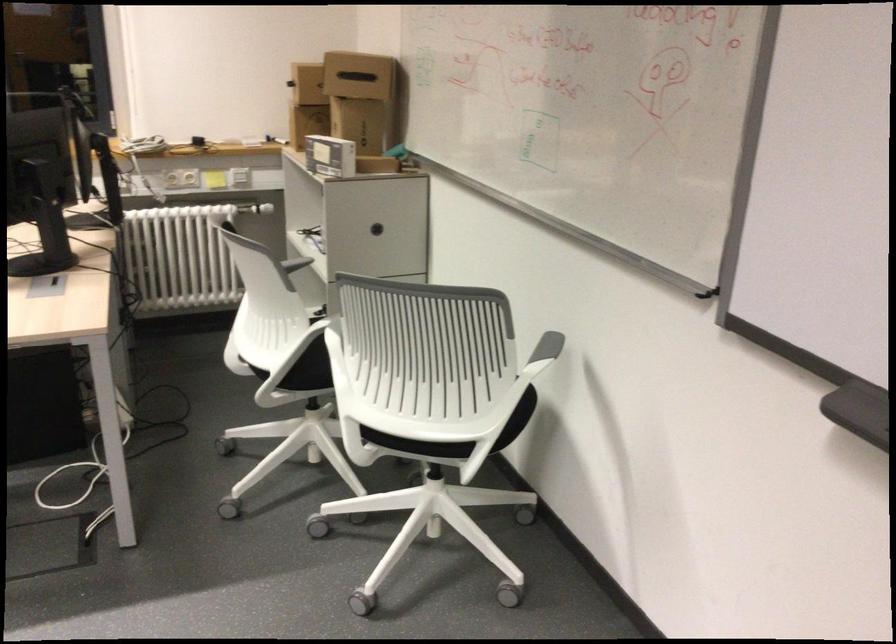
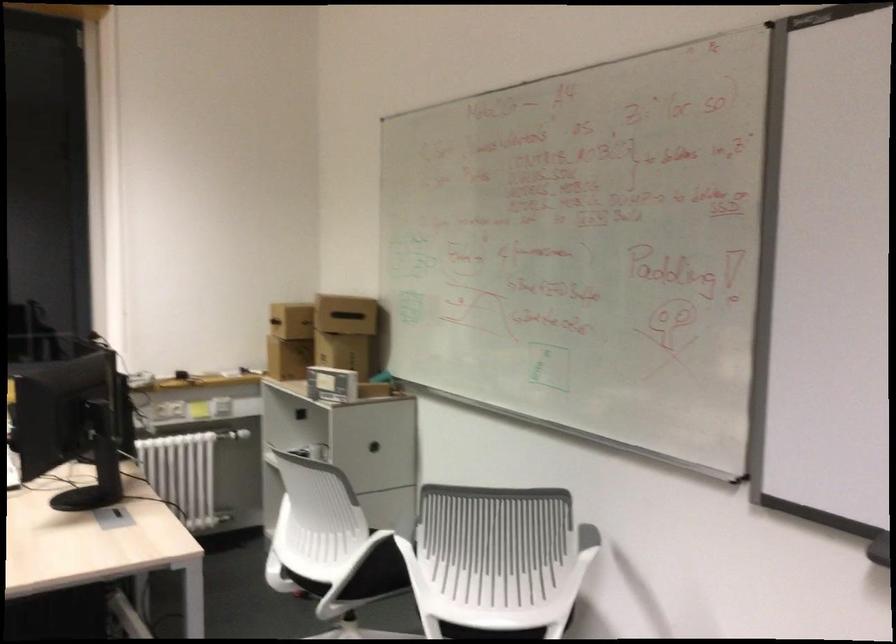
In a continuous first-person perspective shot, in which direction is the camera moving?

The cameraman walked toward left, backward.